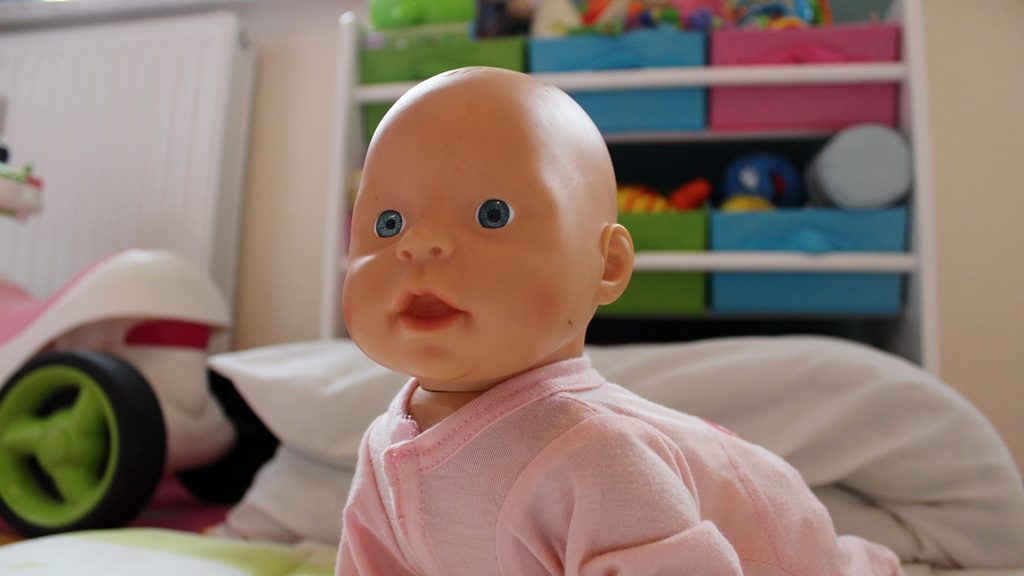
The height and width of the screenshot is (576, 1024). What are the coordinates of `vertical white boards` in the screenshot? It's located at (911, 51), (355, 70).